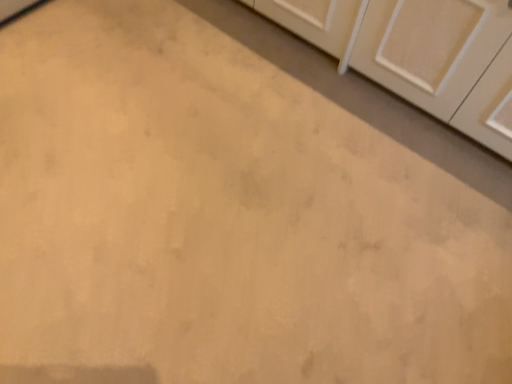
This screenshot has height=384, width=512. What are the coordinates of `blank space situated above white matte cabinet at upper right (from a real-world perspective)` in the screenshot? It's located at (369, 65).